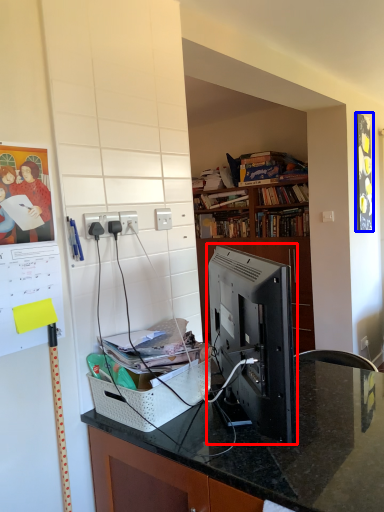
Question: Which point is closer to the camera, desktop computer (highlighted by a red box) or picture frame (highlighted by a blue box)?

Choices:
 (A) desktop computer
 (B) picture frame

Answer: (A)